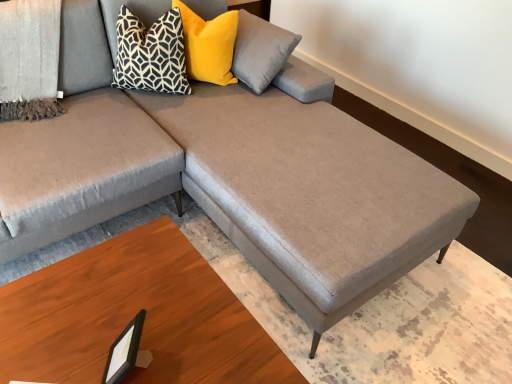
Locate an element on the screen. unoccupied space behind black plastic picture frame at lower left is located at coordinates (141, 307).